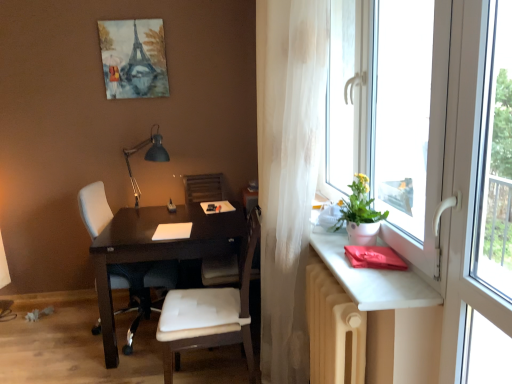
Question: Does white leather chair at center, which appears as the 1th chair when viewed from the left, contain white matte pot at window?

Choices:
 (A) no
 (B) yes

Answer: (A)

Question: Can you confirm if white leather chair at center, marked as the first chair in a back-to-front arrangement, is positioned to the right of white matte pot at window?

Choices:
 (A) yes
 (B) no

Answer: (B)

Question: Could you tell me if white leather chair at center, marked as the first chair in a back-to-front arrangement, is facing white matte pot at window?

Choices:
 (A) no
 (B) yes

Answer: (A)

Question: Is white leather chair at center, which ranks as the 2th chair in front-to-back order, touching white matte pot at window?

Choices:
 (A) yes
 (B) no

Answer: (B)

Question: Is white leather chair at center, which ranks as the 2th chair in front-to-back order, smaller than white matte pot at window?

Choices:
 (A) yes
 (B) no

Answer: (B)

Question: Is white leather chair at center, marked as the first chair in a back-to-front arrangement, wider than white matte pot at window?

Choices:
 (A) yes
 (B) no

Answer: (A)

Question: Is matte white table at right completely or partially outside of beige radiator at lower right?

Choices:
 (A) no
 (B) yes

Answer: (B)

Question: Is matte white table at right shorter than beige radiator at lower right?

Choices:
 (A) no
 (B) yes

Answer: (B)

Question: Considering the relative sizes of matte white table at right and beige radiator at lower right in the image provided, is matte white table at right taller than beige radiator at lower right?

Choices:
 (A) yes
 (B) no

Answer: (B)

Question: Considering the relative sizes of matte white table at right and beige radiator at lower right in the image provided, is matte white table at right smaller than beige radiator at lower right?

Choices:
 (A) no
 (B) yes

Answer: (B)

Question: Does matte white table at right appear on the right side of beige radiator at lower right?

Choices:
 (A) yes
 (B) no

Answer: (A)

Question: From the image's perspective, would you say matte white table at right is shown under beige radiator at lower right?

Choices:
 (A) no
 (B) yes

Answer: (A)

Question: Is beige radiator at lower right to the right of wooden armchair at center from the viewer's perspective?

Choices:
 (A) yes
 (B) no

Answer: (A)